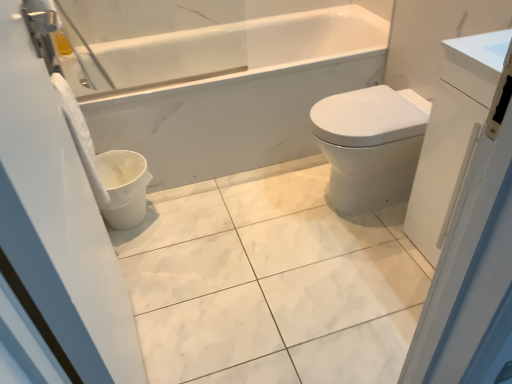
This screenshot has height=384, width=512. I want to click on free space between white glossy cabinet at right, the 1th screen door positioned from the right, and white glossy bidet at right, so [379, 245].